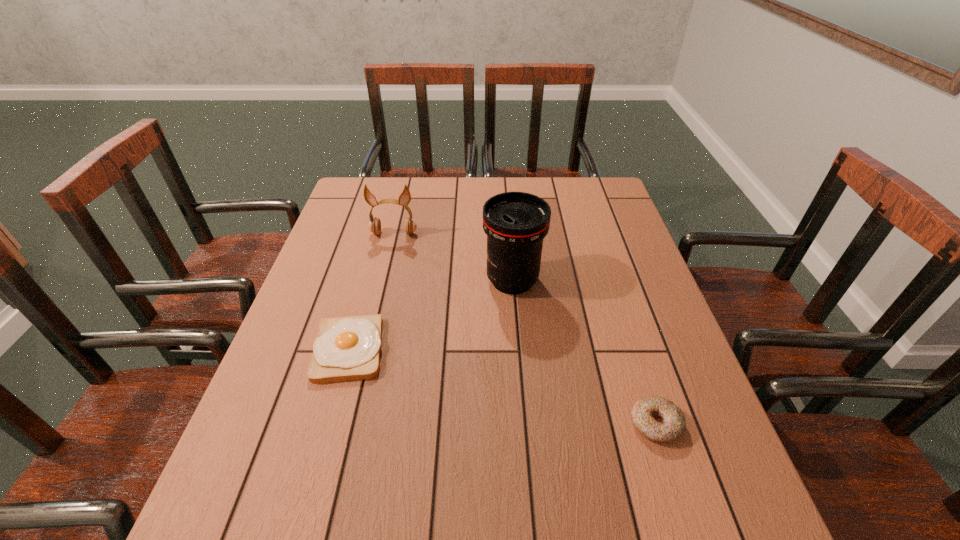
Select which object appears as the third closest to the nearest object. Please provide its 2D coordinates. Your answer should be formatted as a tuple, i.e. [(x, y)], where the tuple contains the x and y coordinates of a point satisfying the conditions above.

[(374, 226)]

Locate an element on the screen. free space that satisfies the following two spatial constraints: 1. on the front-facing side of the farthest object; 2. on the right side of the rightmost object is located at coordinates (348, 424).

Where is `vacant space that satisfies the following two spatial constraints: 1. on the front-facing side of the third shortest object; 2. on the left side of the third object from left to right`? This screenshot has width=960, height=540. vacant space that satisfies the following two spatial constraints: 1. on the front-facing side of the third shortest object; 2. on the left side of the third object from left to right is located at coordinates (382, 281).

Find the location of `vacant region that satisfies the following two spatial constraints: 1. on the front-facing side of the third object from left to right; 2. on the right side of the farthest object`. vacant region that satisfies the following two spatial constraints: 1. on the front-facing side of the third object from left to right; 2. on the right side of the farthest object is located at coordinates (382, 281).

The image size is (960, 540). In order to click on free location that satisfies the following two spatial constraints: 1. on the front side of the nearest object; 2. on the left side of the third object from left to right in this screenshot , I will do `click(524, 424)`.